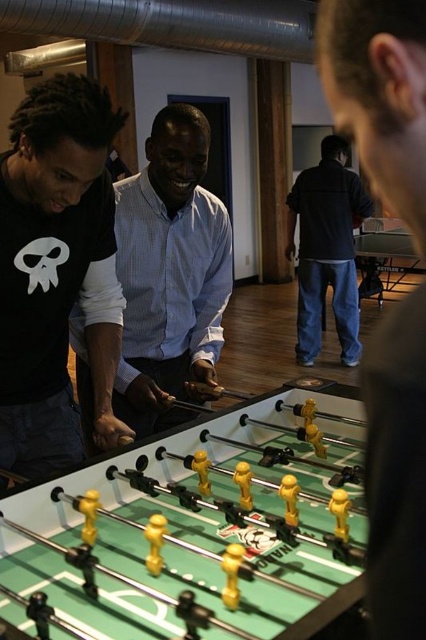
You are a photographer standing in the room and want to take a photo of the green plastic foosball table at center. However, you notice that the dark blue jeans at center are blocking your view. Can you move to the side to capture the entire table without any obstruction?

The green plastic foosball table at center is positioned under dark blue jeans at center, so moving to the side should allow you to capture the entire table without obstruction caused by the jeans.

You are standing in front of the foosball table and see two points marked in the scene. The first point is at coordinates point (36,120) and the second point is at point (394,340). Which point is closer to you?

Point (36,120) is closer to you because it is further to the camera than point (394,340).

You are planning to place a new sofa in the living room. The sofa is 2 meters long. There is a space between the matte black shirt at center and dark blue jeans at center. Can the sofa fit in that space?

The space between the matte black shirt at center and dark blue jeans at center is 4.05 meters. Since the sofa is 2 meters long, it can fit comfortably within that space.